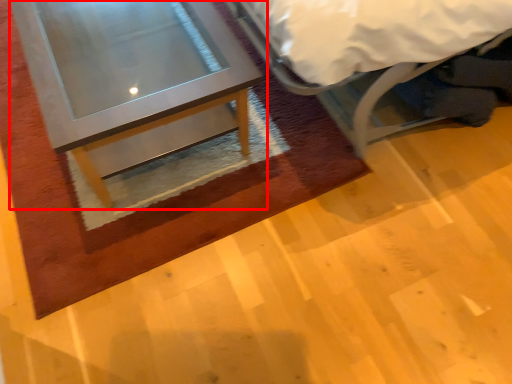
Question: From the image's perspective, considering the relative positions of table (annotated by the red box) and bed in the image provided, where is table (annotated by the red box) located with respect to the staircase?

Choices:
 (A) above
 (B) below

Answer: (B)